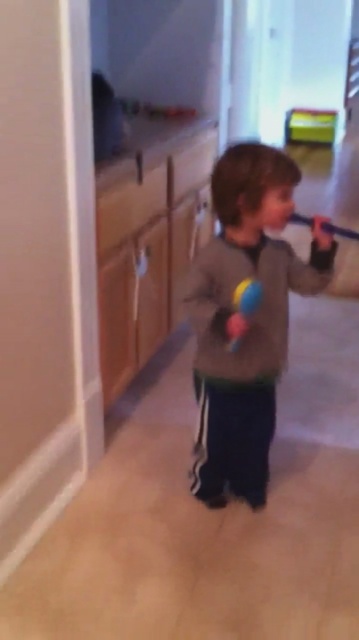
Is point (218, 410) positioned in front of point (244, 280)?

No, it is behind (244, 280).

Locate an element on the screen. This screenshot has height=640, width=359. gray fleece sweater at center is located at coordinates (245, 320).

Locate an element on the screen. This screenshot has width=359, height=640. gray fleece sweater at center is located at coordinates (245, 320).

You are a GUI agent. You are given a task and a screenshot of the screen. Output one action in this format:
    pyautogui.click(x=<x>, y=<y>)
    Task: Click on the gray fleece sweater at center
    
    Given the screenshot: What is the action you would take?
    pyautogui.click(x=245, y=320)